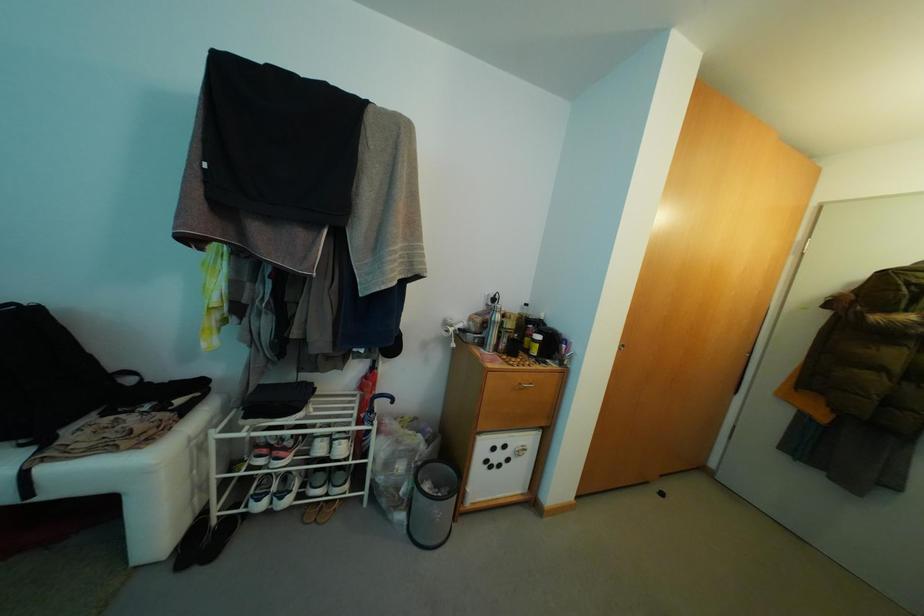
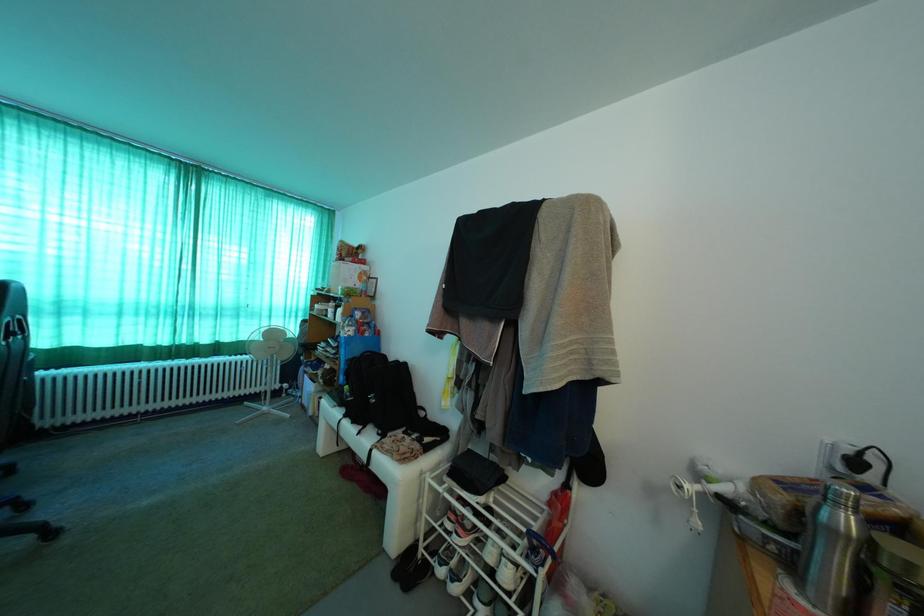
Question: The first image is from the beginning of the video and the second image is from the end. How did the camera likely rotate when shooting the video?

Choices:
 (A) Left
 (B) Right
 (C) Up
 (D) Down

Answer: (A)